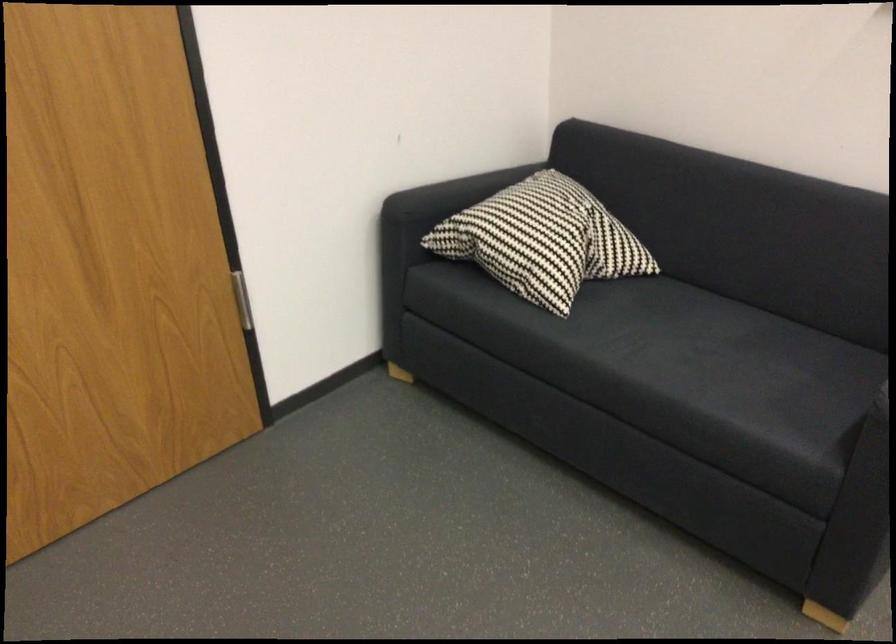
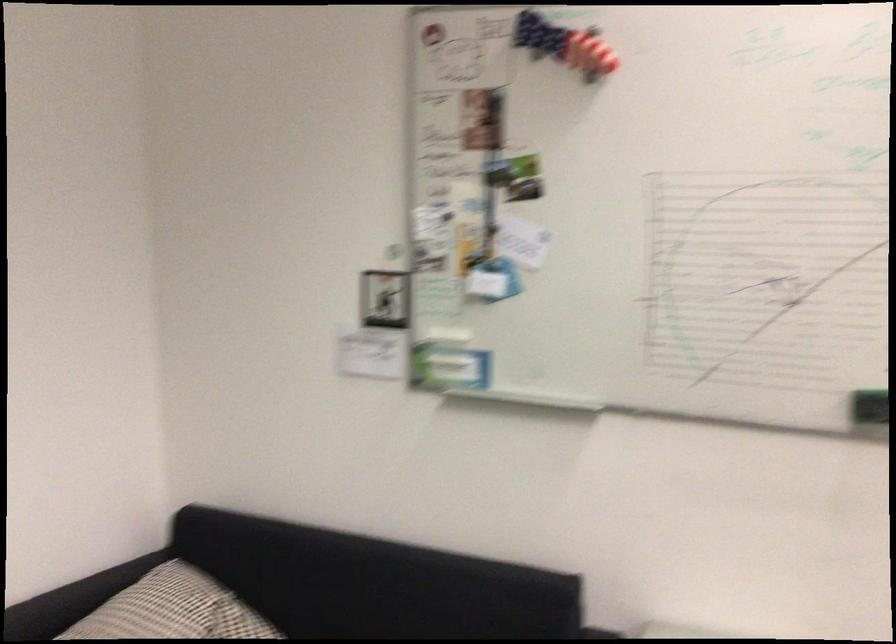
Find the pixel in the second image that matches point 570,210 in the first image.

(193, 612)